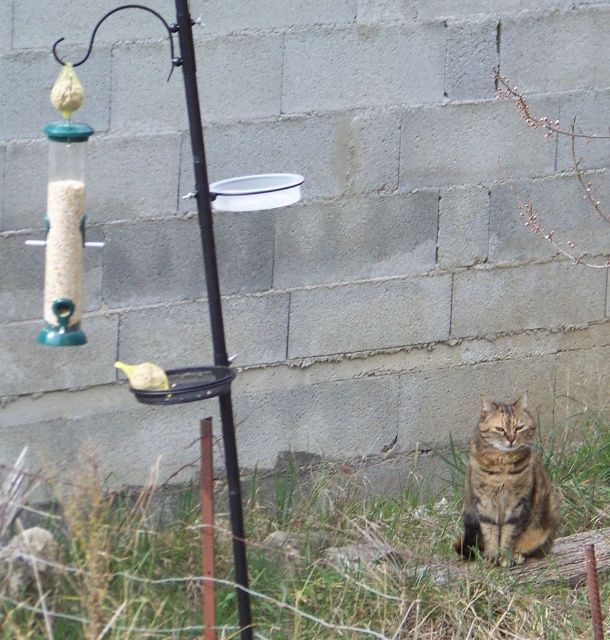
Is green grass at lower right wider than yellow matte bird at left?

Yes, green grass at lower right is wider than yellow matte bird at left.

Is green grass at lower right shorter than yellow matte bird at left?

In fact, green grass at lower right may be taller than yellow matte bird at left.

Describe the element at coordinates (417, 557) in the screenshot. Image resolution: width=610 pixels, height=640 pixels. I see `green grass at lower right` at that location.

Image resolution: width=610 pixels, height=640 pixels. I want to click on green grass at lower right, so click(x=417, y=557).

Is point (292, 602) positioned in front of point (240, 561)?

No, (292, 602) is further to viewer.

Which is more to the right, green grass at lower right or black metal pole at center?

green grass at lower right

I want to click on green grass at lower right, so click(417, 557).

Can you confirm if tabby fur cat at lower right is smaller than yellow matte bird at left?

No, tabby fur cat at lower right is not smaller than yellow matte bird at left.

This screenshot has width=610, height=640. What do you see at coordinates (506, 486) in the screenshot?
I see `tabby fur cat at lower right` at bounding box center [506, 486].

Find the location of a particular element. tabby fur cat at lower right is located at coordinates (506, 486).